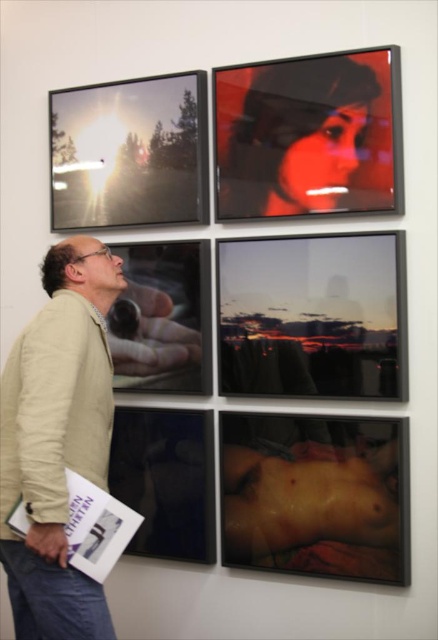
You are an art curator examining the photographs on the wall. You notice two specific images in the grid. One is the smooth skin at lower right and the other is the matte black portrait at upper center. Which of these two photographs has a greater height?

The smooth skin at lower right is taller than the matte black portrait at upper center according to the description.

You are an art curator planning to hang two new paintings in an exhibition. You have a painting of smooth skin at lower right and a matte black portrait at upper center. The wall space between them must be exactly 3 feet to comply with safety regulations. Based on the scene description, will the current spacing between these two artworks meet the requirement?

The distance between the smooth skin at lower right and the matte black portrait at upper center is 3.45 feet, which exceeds the required 3 feet. Therefore, the current spacing meets the safety regulations.

You are an artist analyzing the spatial arrangement of the displayed photos. The beige cotton jacket at lower left and the matte black portrait at upper center are two elements in the scene. Which of these two items has a greater vertical height in the composition?

The beige cotton jacket at lower left is much taller than the matte black portrait at upper center, so it has a greater vertical height in the composition.